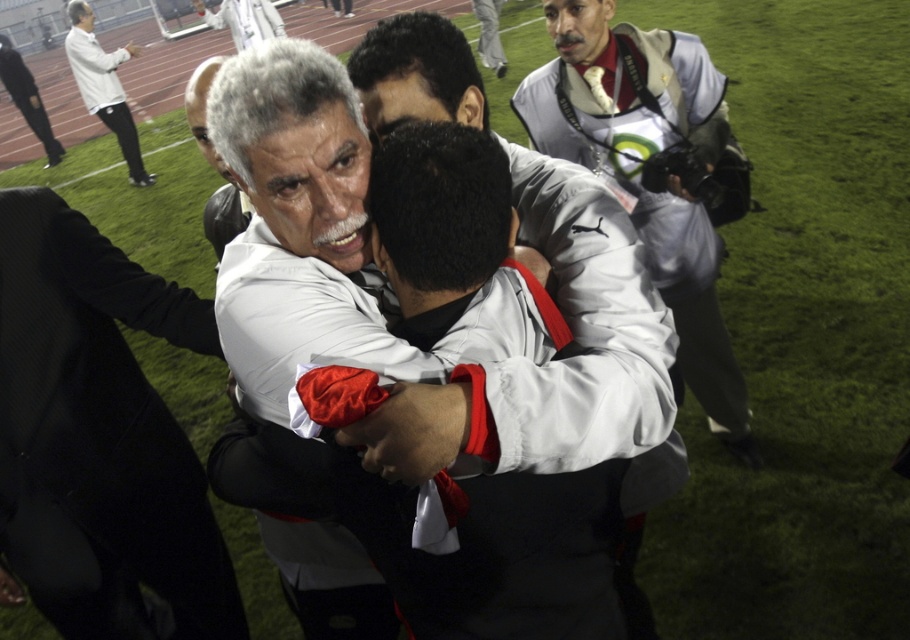
Question: Among these points, which one is nearest to the camera?

Choices:
 (A) (275, 180)
 (B) (584, 45)
 (C) (118, 58)
 (D) (24, 362)

Answer: (A)

Question: Which of the following is the farthest from the observer?

Choices:
 (A) white matte jacket at upper left
 (B) white matte jacket at center
 (C) white matte jacket at upper center

Answer: (A)

Question: Which point is closer to the camera?

Choices:
 (A) (605, 102)
 (B) (86, 19)
 (C) (258, 264)
 (D) (16, 520)

Answer: (C)

Question: Does white matte jacket at upper center have a smaller size compared to white matte jacket at upper left?

Choices:
 (A) no
 (B) yes

Answer: (B)

Question: Can you confirm if white matte jacket at center is thinner than white matte jacket at upper center?

Choices:
 (A) no
 (B) yes

Answer: (B)

Question: Can you confirm if white matte jacket at center is positioned to the left of white matte jacket at upper center?

Choices:
 (A) yes
 (B) no

Answer: (A)